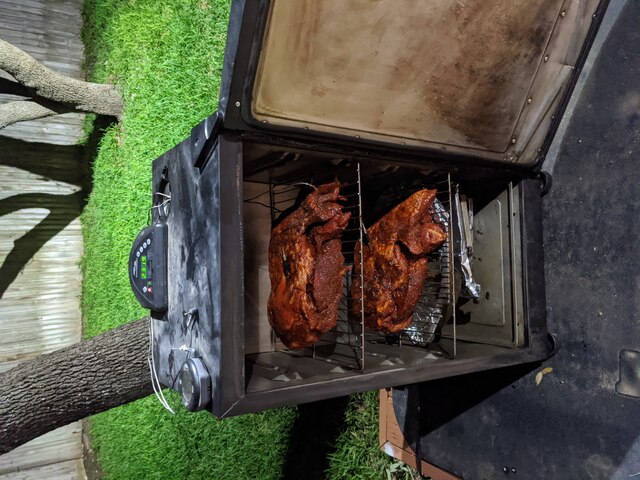
Image resolution: width=640 pixels, height=480 pixels. What are the coordinates of `display` in the screenshot? It's located at (285, 108).